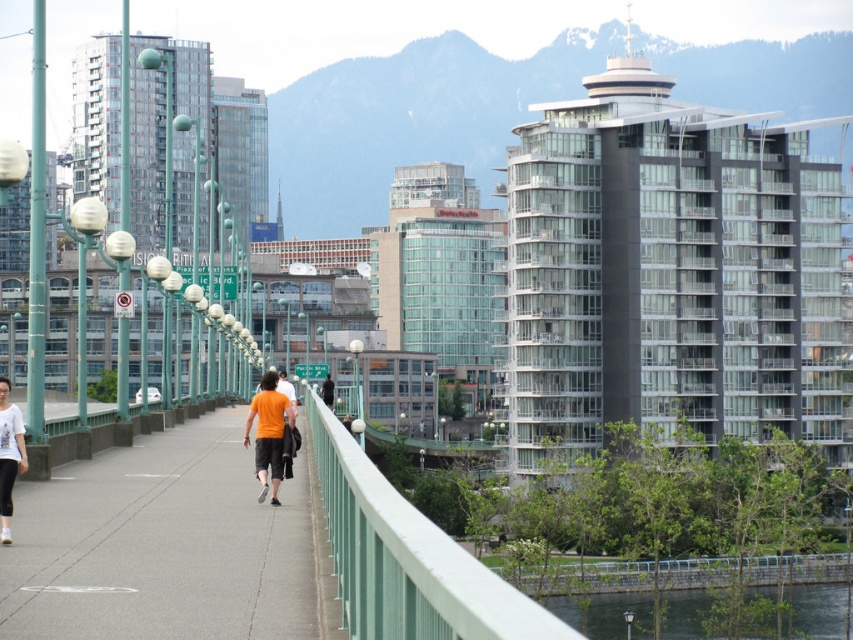
Question: Is concrete sidewalk at center below green painted metal railing at center?

Choices:
 (A) no
 (B) yes

Answer: (B)

Question: Which point is closer to the camera taking this photo?

Choices:
 (A) (0, 509)
 (B) (515, 608)

Answer: (B)

Question: Which object appears farthest from the camera in this image?

Choices:
 (A) concrete sidewalk at center
 (B) white matte shirt at left
 (C) green stone wall at lower right
 (D) green painted metal railing at center

Answer: (C)

Question: Which of the following is the farthest from the observer?

Choices:
 (A) green painted metal railing at center
 (B) white matte shirt at left
 (C) concrete sidewalk at center

Answer: (B)

Question: Can you confirm if green stone wall at lower right is wider than white matte shirt at left?

Choices:
 (A) no
 (B) yes

Answer: (B)

Question: Does green painted metal railing at center appear over green stone wall at lower right?

Choices:
 (A) no
 (B) yes

Answer: (B)